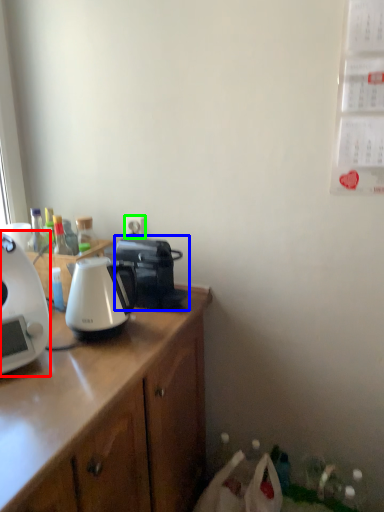
Question: Estimate the real-world distances between objects in this image. Which object is farther from coffee maker (highlighted by a red box), coffee maker (highlighted by a blue box) or power outlet (highlighted by a green box)?

Choices:
 (A) coffee maker
 (B) power outlet

Answer: (B)